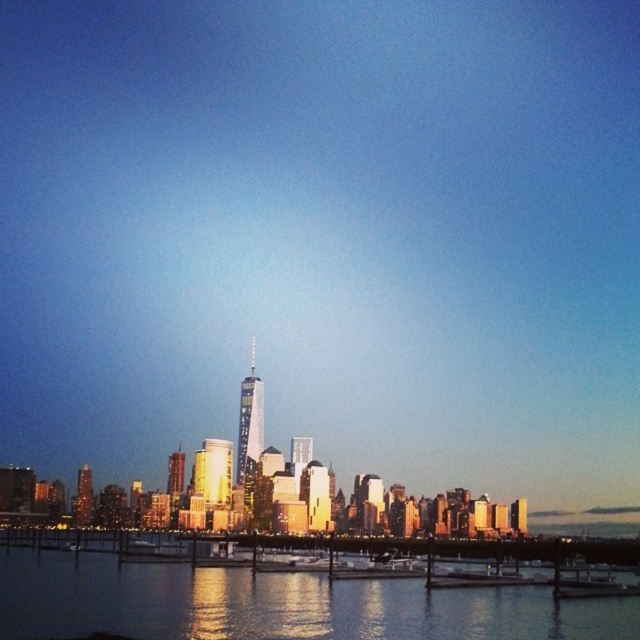
You are a drone operator tasked with capturing aerial footage of the city. Your drone has a maximum flight range of 120 meters. If you are currently positioned above the glistening water at lower center, can you fly your drone to the shiny glass skyscraper at center without exceeding its range?

The distance between the glistening water at lower center and the shiny glass skyscraper at center is 131.51 meters, which exceeds the drone operator maximum flight range of 120 meters. Therefore, the drone cannot reach the shiny glass skyscraper at center from the glistening water at lower center without exceeding its range.

You are a photographer aiming to capture the reflection of the shiny glass skyscraper at center in the glistening water at lower center. Based on the scene, will the reflection of the skyscraper be fully visible in the water?

The glistening water at lower center has a lesser height compared to the shiny glass skyscraper at center, so the reflection may not be fully visible as the water is shorter in height than the skyscraper.